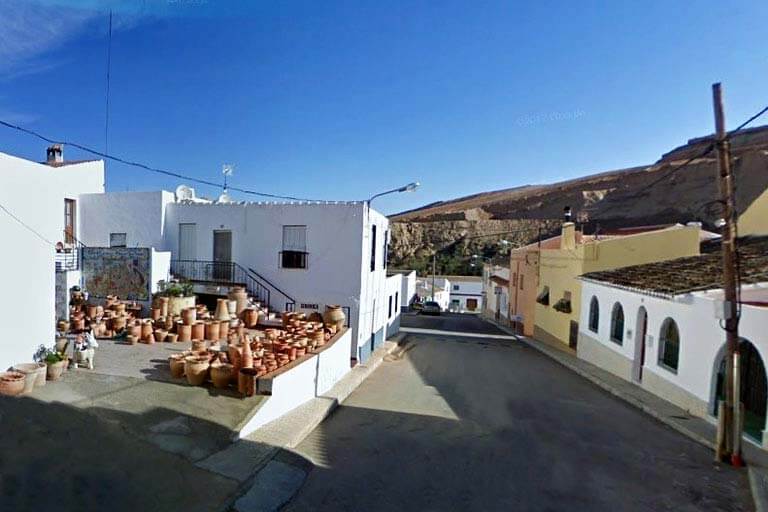
You are a GUI agent. You are given a task and a screenshot of the screen. Output one action in this format:
    pyautogui.click(x=<x>, y=<y>)
    Task: Click on the cable
    
    Given the screenshot: What is the action you would take?
    pyautogui.click(x=174, y=174), pyautogui.click(x=740, y=126)